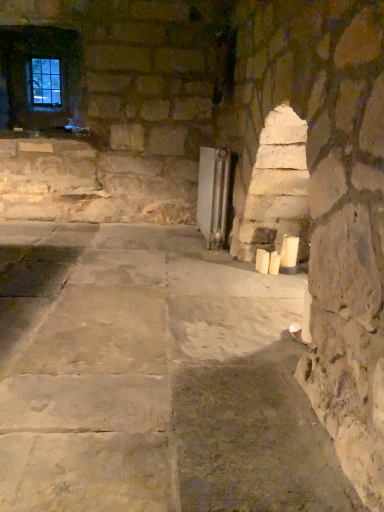
Question: From the image's perspective, is clear glass window at upper left on top of white wax candle at right, the third candle positioned from the left?

Choices:
 (A) no
 (B) yes

Answer: (B)

Question: Is clear glass window at upper left at the right side of white wax candle at right, the third candle positioned from the left?

Choices:
 (A) no
 (B) yes

Answer: (A)

Question: Could you tell me if clear glass window at upper left is facing white wax candle at right, the third candle positioned from the left?

Choices:
 (A) no
 (B) yes

Answer: (A)

Question: Is clear glass window at upper left not within white wax candle at right, the third candle positioned from the left?

Choices:
 (A) no
 (B) yes

Answer: (B)

Question: From a real-world perspective, does clear glass window at upper left sit lower than white wax candle at right, the third candle positioned from the left?

Choices:
 (A) no
 (B) yes

Answer: (A)

Question: Are clear glass window at upper left and white wax candle at right, placed as the 1th candle when sorted from right to left, far apart?

Choices:
 (A) yes
 (B) no

Answer: (A)

Question: Can you confirm if white wax candle at right, the third candle positioned from the left, is shorter than white wax candle at lower right, acting as the 2th candle starting from the right?

Choices:
 (A) yes
 (B) no

Answer: (B)

Question: From the image's perspective, would you say white wax candle at right, the third candle positioned from the left, is positioned over white wax candle at lower right, the second candle positioned from the left?

Choices:
 (A) no
 (B) yes

Answer: (B)

Question: Is the position of white wax candle at right, the third candle positioned from the left, more distant than that of white wax candle at lower right, acting as the 2th candle starting from the right?

Choices:
 (A) yes
 (B) no

Answer: (B)

Question: Is white wax candle at right, the third candle positioned from the left, looking in the opposite direction of white wax candle at lower right, acting as the 2th candle starting from the right?

Choices:
 (A) yes
 (B) no

Answer: (B)

Question: Is white wax candle at right, the third candle positioned from the left, facing towards white wax candle at lower right, acting as the 2th candle starting from the right?

Choices:
 (A) no
 (B) yes

Answer: (B)

Question: Can white wax candle at lower right, acting as the 2th candle starting from the right, be found inside white wax candle at right, placed as the 1th candle when sorted from right to left?

Choices:
 (A) no
 (B) yes

Answer: (A)

Question: Considering the relative sizes of white wax candle at lower right, acting as the 2th candle starting from the right, and clear glass window at upper left in the image provided, is white wax candle at lower right, acting as the 2th candle starting from the right, taller than clear glass window at upper left?

Choices:
 (A) yes
 (B) no

Answer: (B)